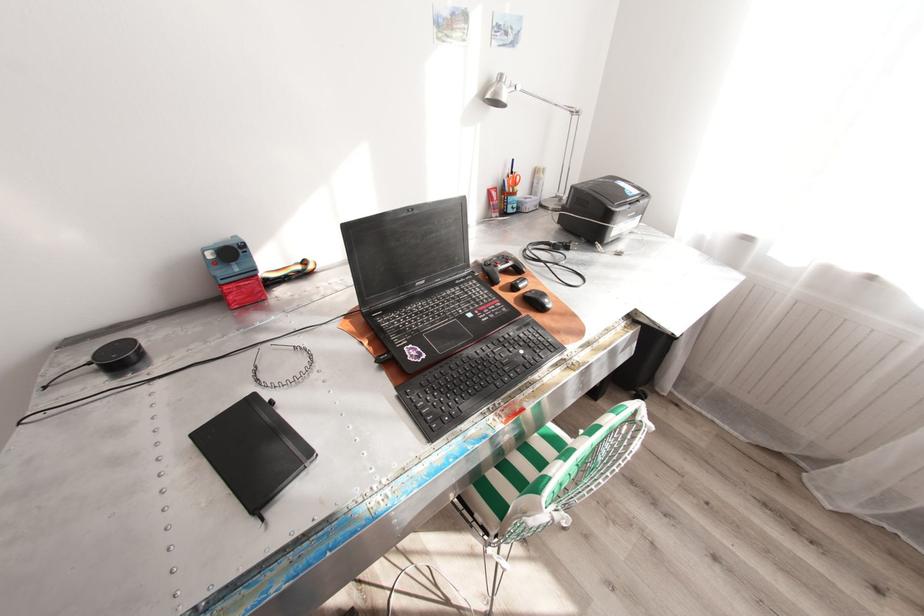
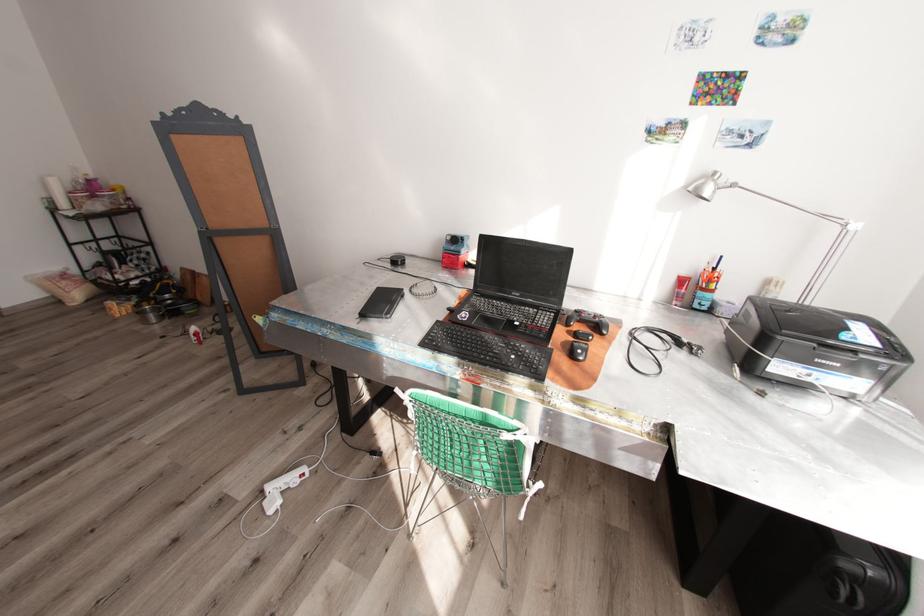
Where in the second image is the point corresponding to point 631,197 from the first image?

(841, 338)